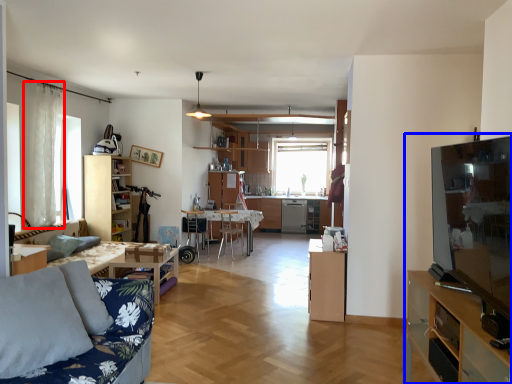
Question: Which object is closer to the camera taking this photo, curtain (highlighted by a red box) or entertainment center (highlighted by a blue box)?

Choices:
 (A) curtain
 (B) entertainment center

Answer: (B)